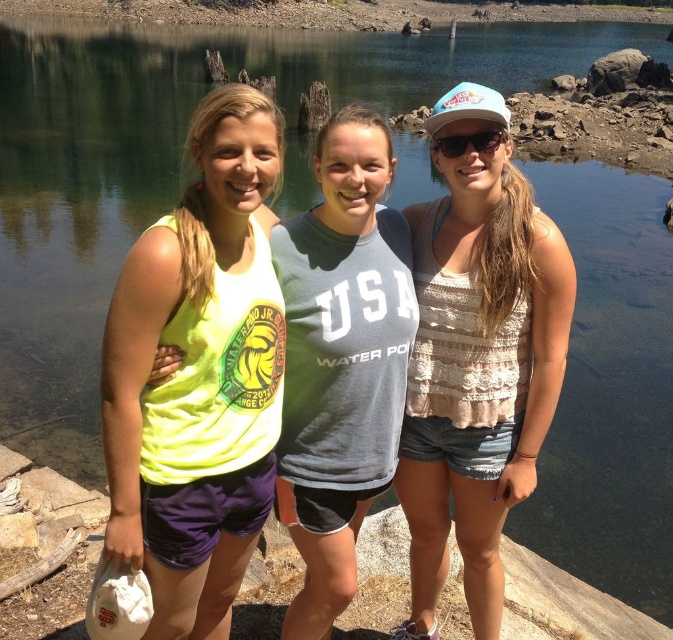
You are a photographer trying to capture a group photo of the neon yellow tank top at center and the white textured tank top at center. Which person should you focus on first if you want to include both in the frame without cropping either?

You should focus on the white textured tank top at center first because it occupies more space than the neon yellow tank top at center, ensuring it fits entirely within the frame.

You are a fashion designer observing the three people in the image. You need to create a new outfit that combines elements from the neon yellow tank top at center and the white textured tank top at center. Which tank top should you use as the base for the sleeves since it has a slimmer fit?

The neon yellow tank top at center is thinner than the white textured tank top at center, so the neon yellow tank top at center should be used as the base for the sleeves since it has a slimmer fit.